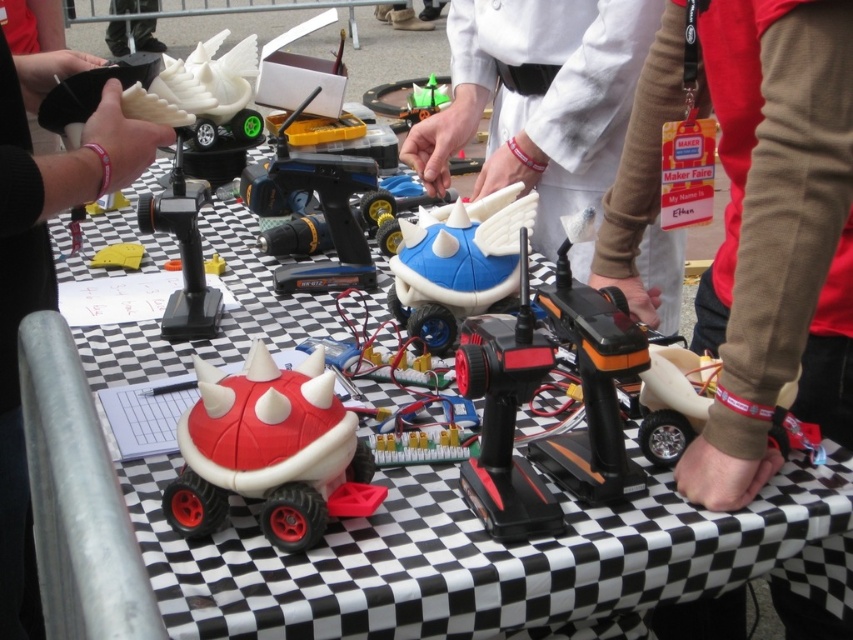
You are a visitor at the Maker Faire and notice the matte black glove at upper left and the green matte toy at center. From your perspective, which object is positioned lower on the table?

The matte black glove at upper left is positioned below the green matte toy at center, so it is lower on the table.

You are at the Maker Faire and see two points marked on the table where the robots are displayed. According to their coordinates, which point is closer to you, point [830,164] or point [430,96]?

Point [830,164] is in front of point [430,96], so it is closer to you.